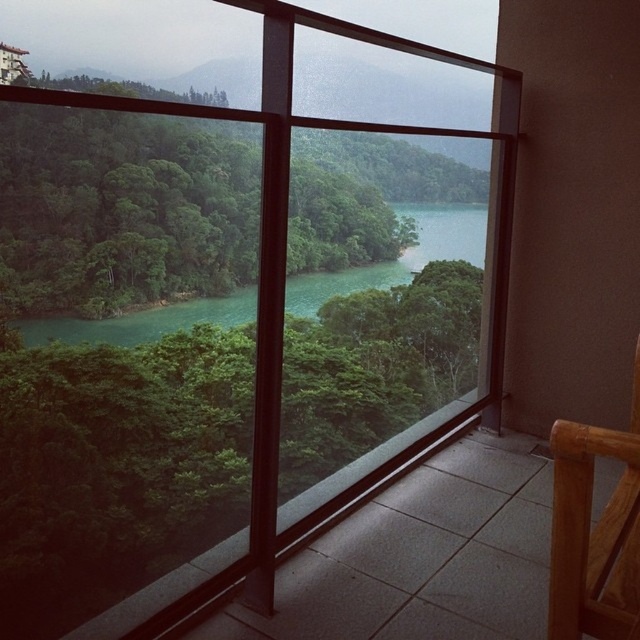
Consider the image. You are standing inside the building looking out the window. Where is the green leafy tree at center located relative to the window frame?

The green leafy tree at center is located at the coordinates point (122, 209) relative to the window frame.

You are standing on the balcony and want to place a 10 feet long bench between the green leafy tree at center and the bamboo chair at lower right. Is there enough space between them to fit the bench?

The distance between the green leafy tree at center and the bamboo chair at lower right is 41.43 feet, which is more than enough to fit a 10 feet long bench between them.

You are standing on the balcony and want to sit in the bamboo chair at lower right. Is the green leafy tree at center blocking your path to the chair?

The green leafy tree at center is positioned over the bamboo chair at lower right, so it might cast shade on the chair but does not physically block the path to it. You can still reach the bamboo chair at lower right without obstacles.